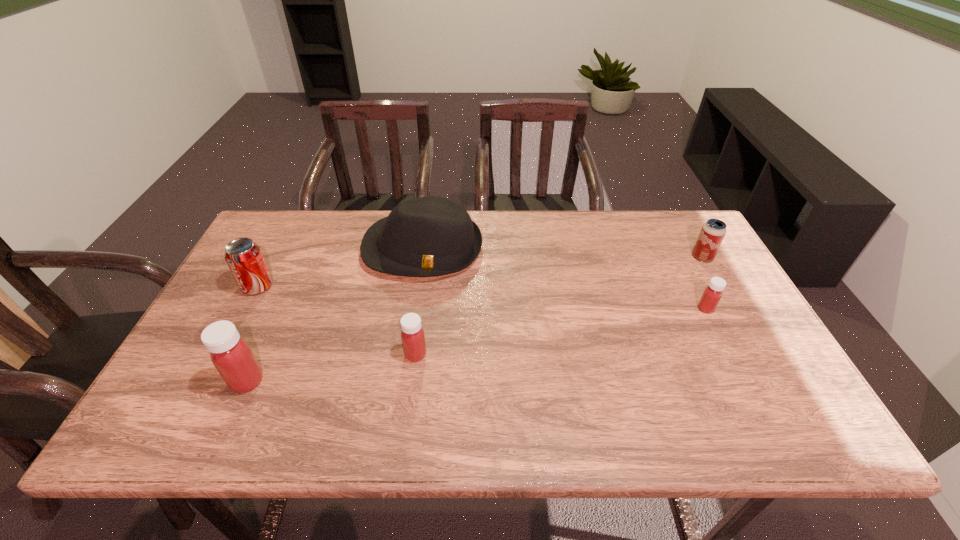
Find the location of a particular element. This screenshot has height=540, width=960. medicine present at the right edge is located at coordinates (712, 294).

At what (x,y) coordinates should I click in order to perform the action: click on beer can located in the right edge section of the desktop. Please return your answer as a coordinate pair (x, y). Looking at the image, I should click on (712, 233).

Where is `object that is at the near left corner`? The width and height of the screenshot is (960, 540). object that is at the near left corner is located at coordinates (231, 355).

Where is `object at the far right corner`? Image resolution: width=960 pixels, height=540 pixels. object at the far right corner is located at coordinates (712, 233).

Locate an element on the screen. Image resolution: width=960 pixels, height=540 pixels. free space at the far edge of the desktop is located at coordinates (310, 251).

Locate an element on the screen. Image resolution: width=960 pixels, height=540 pixels. vacant position at the near edge of the desktop is located at coordinates (518, 398).

In the image, there is a desktop. Identify the location of vacant space at the left edge. (272, 264).

Locate an element on the screen. vacant space at the right edge is located at coordinates (734, 349).

In the image, there is a desktop. At what (x,y) coordinates should I click in order to perform the action: click on vacant area at the far left corner. Please return your answer as a coordinate pair (x, y). Looking at the image, I should click on (304, 217).

Image resolution: width=960 pixels, height=540 pixels. Identify the location of free spot at the near left corner of the desktop. (182, 384).